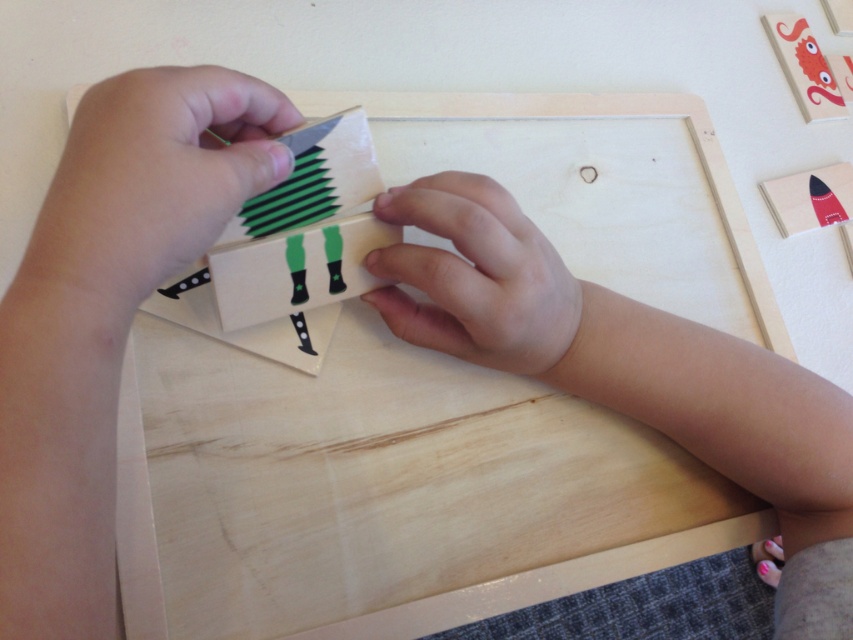
Question: Is matte green paper at center below matte red rocket at upper right?

Choices:
 (A) no
 (B) yes

Answer: (B)

Question: Is matte green paper at upper left positioned at the back of matte green paper at center?

Choices:
 (A) yes
 (B) no

Answer: (B)

Question: Based on their relative distances, which object is farther from the matte green paper at center?

Choices:
 (A) matte red rocket at upper right
 (B) green matte paper at upper center

Answer: (A)

Question: Is matte green paper at upper left closer to the viewer compared to matte green paper at center?

Choices:
 (A) yes
 (B) no

Answer: (A)

Question: Among these points, which one is farthest from the camera?

Choices:
 (A) (531, 252)
 (B) (311, 204)
 (C) (270, 109)
 (D) (851, 204)

Answer: (D)

Question: Which point is farther to the camera?

Choices:
 (A) green matte paper at upper center
 (B) smooth skin hand at center
 (C) matte red rocket at upper right

Answer: (C)